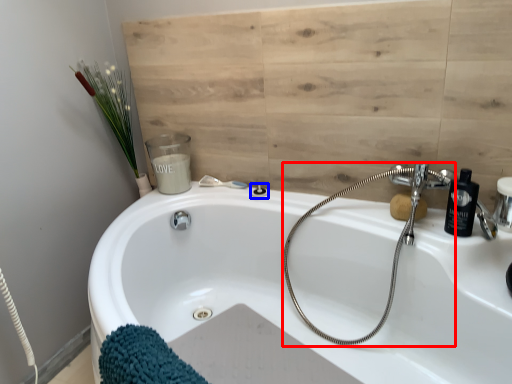
Question: Which object appears farthest to the camera in this image, plumbing fixture (highlighted by a red box) or shower (highlighted by a blue box)?

Choices:
 (A) plumbing fixture
 (B) shower

Answer: (B)